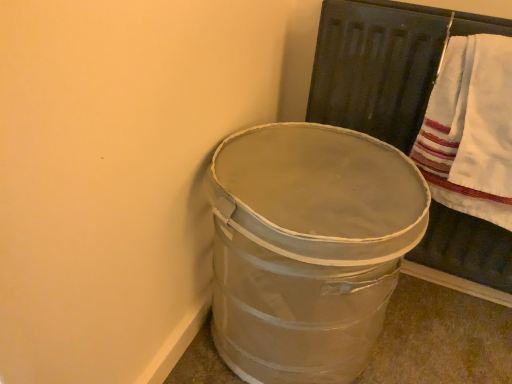
Question: From a real-world perspective, is white cotton towel at upper right positioned above or below metallic silver bucket at lower right?

Choices:
 (A) above
 (B) below

Answer: (A)

Question: Visually, is white cotton towel at upper right positioned to the left or to the right of metallic silver bucket at lower right?

Choices:
 (A) left
 (B) right

Answer: (B)

Question: From the image's perspective, relative to metallic silver bucket at lower right, is white cotton towel at upper right above or below?

Choices:
 (A) above
 (B) below

Answer: (A)

Question: Is metallic silver bucket at lower right situated inside white cotton towel at upper right or outside?

Choices:
 (A) inside
 (B) outside

Answer: (B)

Question: From a real-world perspective, is metallic silver bucket at lower right positioned above or below white cotton towel at upper right?

Choices:
 (A) below
 (B) above

Answer: (A)

Question: Looking at their shapes, would you say metallic silver bucket at lower right is wider or thinner than white cotton towel at upper right?

Choices:
 (A) thin
 (B) wide

Answer: (B)

Question: Considering the positions of point (370, 253) and point (471, 192), is point (370, 253) closer or farther from the camera than point (471, 192)?

Choices:
 (A) closer
 (B) farther

Answer: (A)